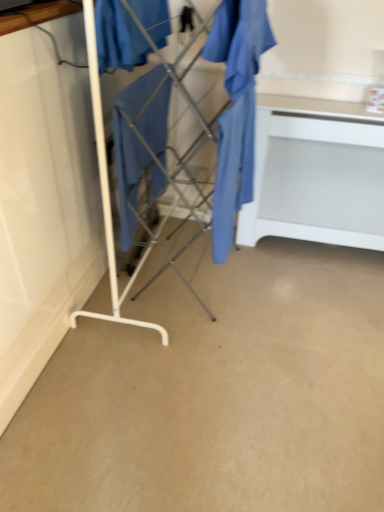
Identify the location of vacant space to the right of metal drying rack at center. The image size is (384, 512). (272, 286).